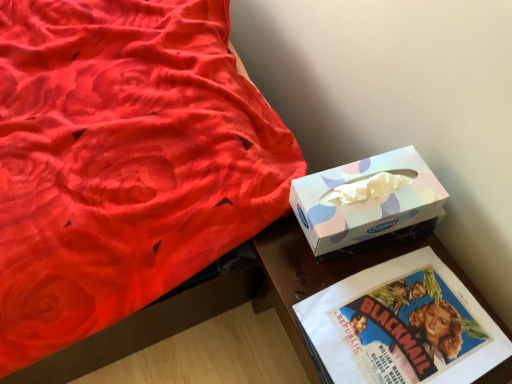
Question: Can you confirm if velvet red bed at upper left is positioned to the left of wooden glossy table at lower right?

Choices:
 (A) yes
 (B) no

Answer: (A)

Question: Does velvet red bed at upper left have a lesser width compared to wooden glossy table at lower right?

Choices:
 (A) yes
 (B) no

Answer: (B)

Question: Does velvet red bed at upper left have a lesser height compared to wooden glossy table at lower right?

Choices:
 (A) no
 (B) yes

Answer: (A)

Question: Does velvet red bed at upper left touch wooden glossy table at lower right?

Choices:
 (A) no
 (B) yes

Answer: (A)

Question: Is there a large distance between velvet red bed at upper left and wooden glossy table at lower right?

Choices:
 (A) yes
 (B) no

Answer: (B)

Question: From a real-world perspective, relative to pastel paper tissue box at right, is wooden glossy table at lower right vertically above or below?

Choices:
 (A) above
 (B) below

Answer: (B)

Question: Considering the positions of point (288, 299) and point (426, 168), is point (288, 299) closer or farther from the camera than point (426, 168)?

Choices:
 (A) farther
 (B) closer

Answer: (A)

Question: From their relative heights in the image, would you say wooden glossy table at lower right is taller or shorter than pastel paper tissue box at right?

Choices:
 (A) tall
 (B) short

Answer: (B)

Question: In the image, is wooden glossy table at lower right positioned in front of or behind pastel paper tissue box at right?

Choices:
 (A) front
 (B) behind

Answer: (A)

Question: Which is correct: pastel paper tissue box at right is inside wooden glossy table at lower right, or outside of it?

Choices:
 (A) outside
 (B) inside

Answer: (A)

Question: From the image's perspective, is pastel paper tissue box at right located above or below wooden glossy table at lower right?

Choices:
 (A) below
 (B) above

Answer: (B)

Question: Considering their positions, is pastel paper tissue box at right located in front of or behind wooden glossy table at lower right?

Choices:
 (A) behind
 (B) front

Answer: (A)

Question: Visually, is pastel paper tissue box at right positioned to the left or to the right of wooden glossy table at lower right?

Choices:
 (A) right
 (B) left

Answer: (B)

Question: In the image, is velvet red bed at upper left on the left side or the right side of pastel paper tissue box at right?

Choices:
 (A) right
 (B) left

Answer: (B)

Question: Is velvet red bed at upper left wider or thinner than pastel paper tissue box at right?

Choices:
 (A) wide
 (B) thin

Answer: (A)